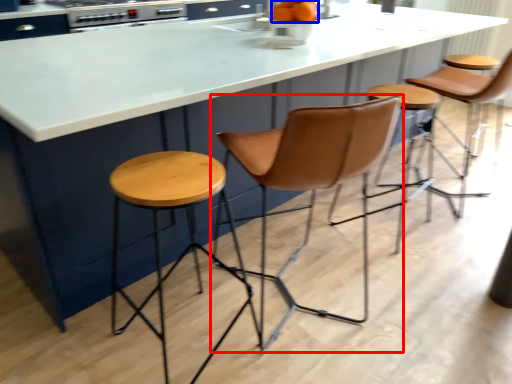
Question: Which point is closer to the camera, swivel chair (highlighted by a red box) or orange (highlighted by a blue box)?

Choices:
 (A) swivel chair
 (B) orange

Answer: (A)